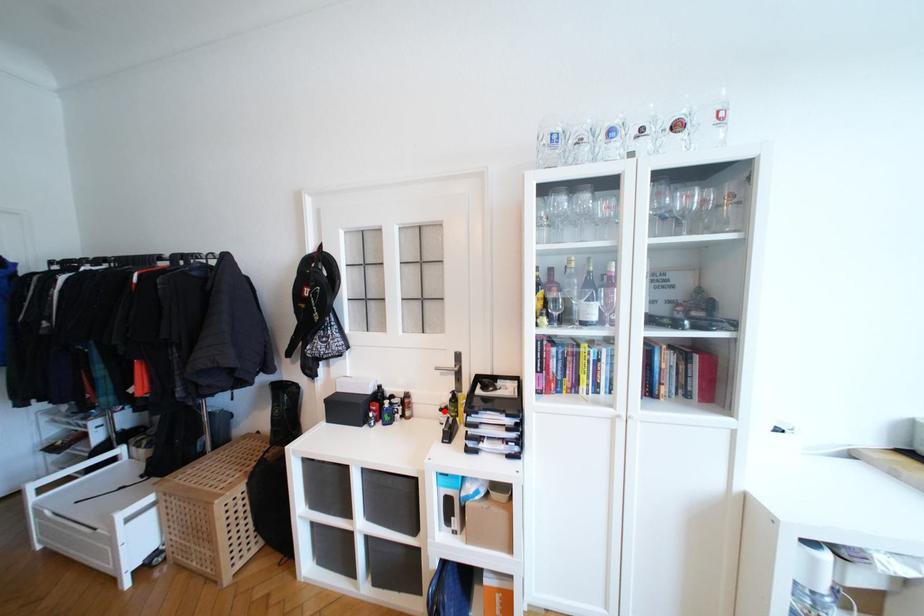
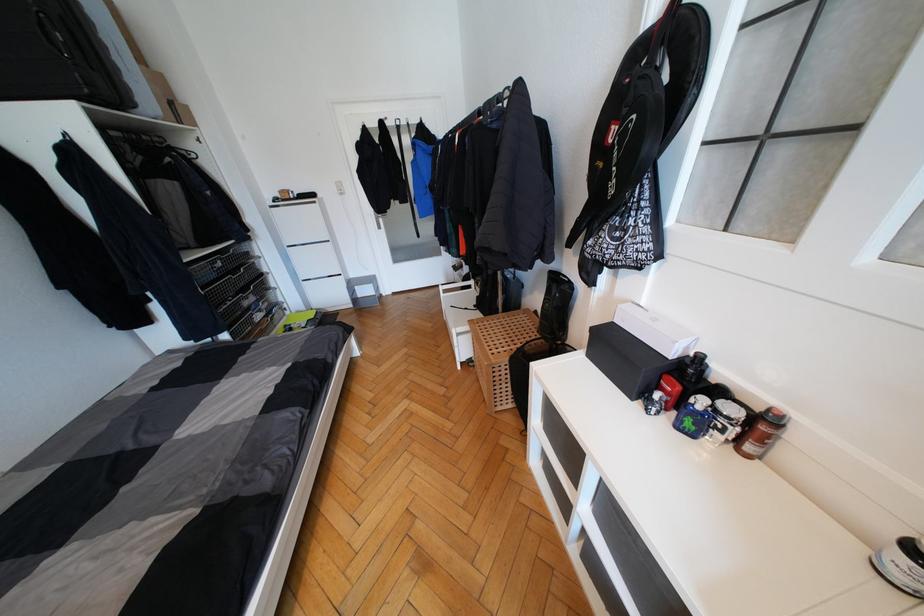
Where in the second image is the point corresponding to the highlighted location from the first image?

(916, 551)